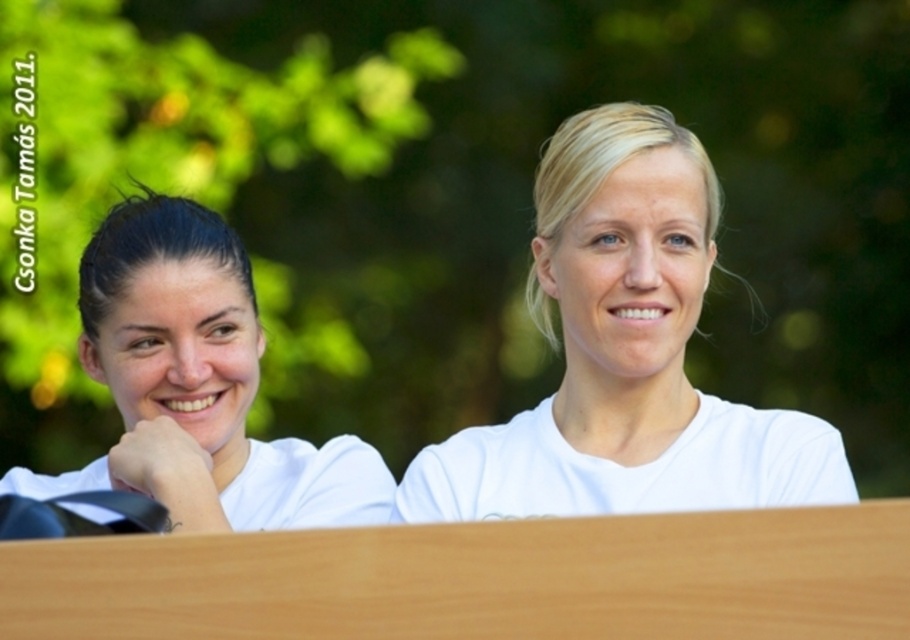
You are a photographer trying to adjust the lighting for a group photo. You notice two people wearing white matte shirts. The first person is wearing a white matte shirt at left, and the second person has a white matte shirt at center. Based on their positions, which shirt is closer to the right side of the frame?

The white matte shirt at center is positioned on the right side of the white matte shirt at left, so the white matte shirt at center is closer to the right side of the frame.

You are a photographer holding a camera and want to take a closeup shot of the white matte shirt at center. The camera requires the subject to be at least 5 feet away for optimal focus. Are you positioned far enough away to achieve a clear photo?

The white matte shirt at center and camera are 6.62 feet apart from each other, which is more than the required 5 feet. Therefore, you are positioned far enough away to achieve a clear photo.